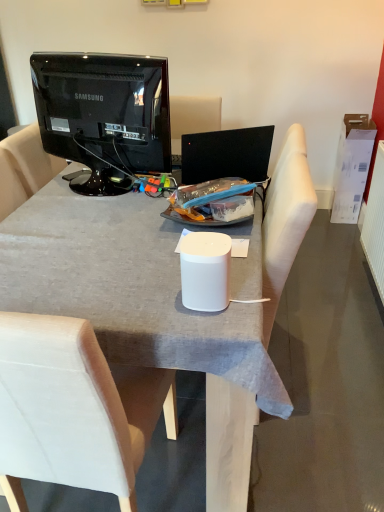
Where is `free spot below glossy black television at upper left (from a real-world perspective)`? Image resolution: width=384 pixels, height=512 pixels. free spot below glossy black television at upper left (from a real-world perspective) is located at coordinates 101,185.